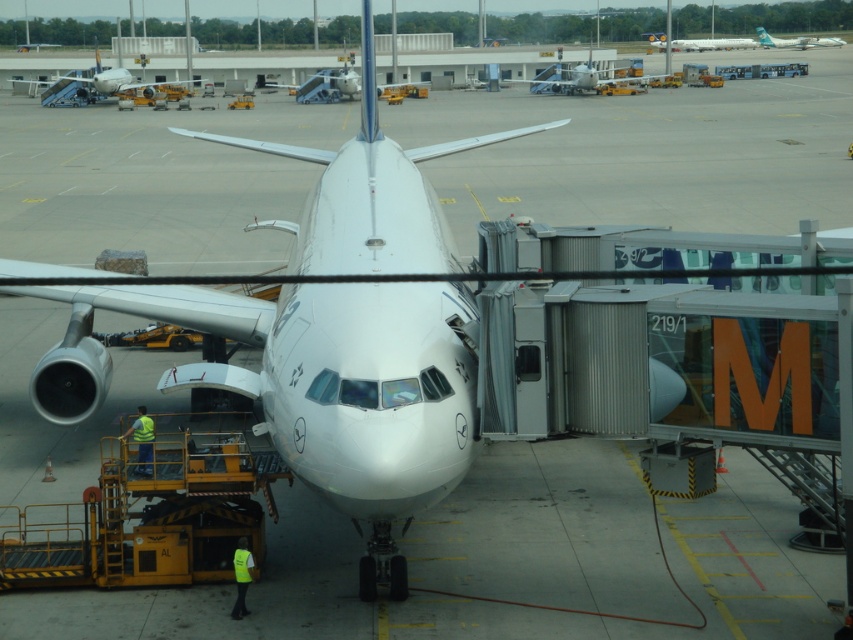
You are an airport ground crew member who needs to park a new silver metallic airplane at center. There is a space available at the upper right where another silver metallic airplane at upper right is currently parked. Based on their sizes, can the new airplane fit into that space?

The silver metallic airplane at center is wider than the silver metallic airplane at upper right. Therefore, the new silver metallic airplane at center may not fit into the space currently occupied by the silver metallic airplane at upper right due to its larger width.

You are a maintenance worker needing to retrieve a tool from the ground. You see the metallic silver airplane at center and the green reflective vest at lower left. Which object is taller and requires you to look up more?

The metallic silver airplane at center is much taller than the green reflective vest at lower left, so you need to look up more to see the metallic silver airplane at center.

You are a ground crew member wearing the green reflective vest at lower left and need to inspect the metallic silver airplane at center. Which direction should you move to reach it?

The metallic silver airplane at center is to the right of the green reflective vest at lower left, so you should move to your right to reach it.